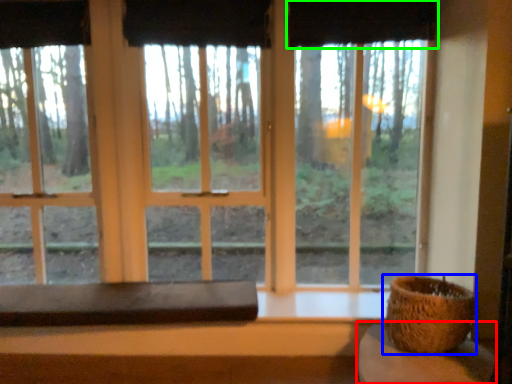
Question: Which object is positioned farthest from table (highlighted by a red box)? Select from flowerpot (highlighted by a blue box) and curtain (highlighted by a green box).

Choices:
 (A) flowerpot
 (B) curtain

Answer: (B)